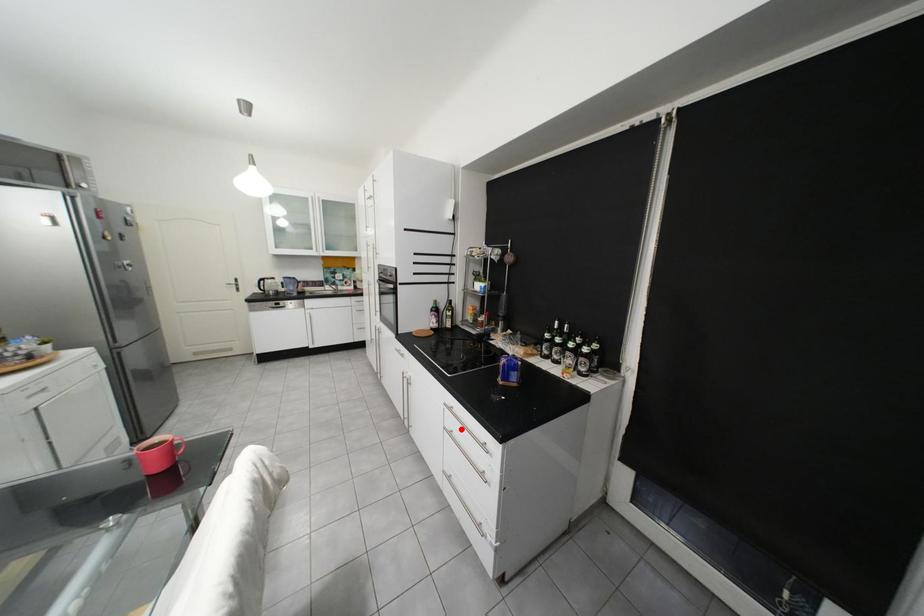
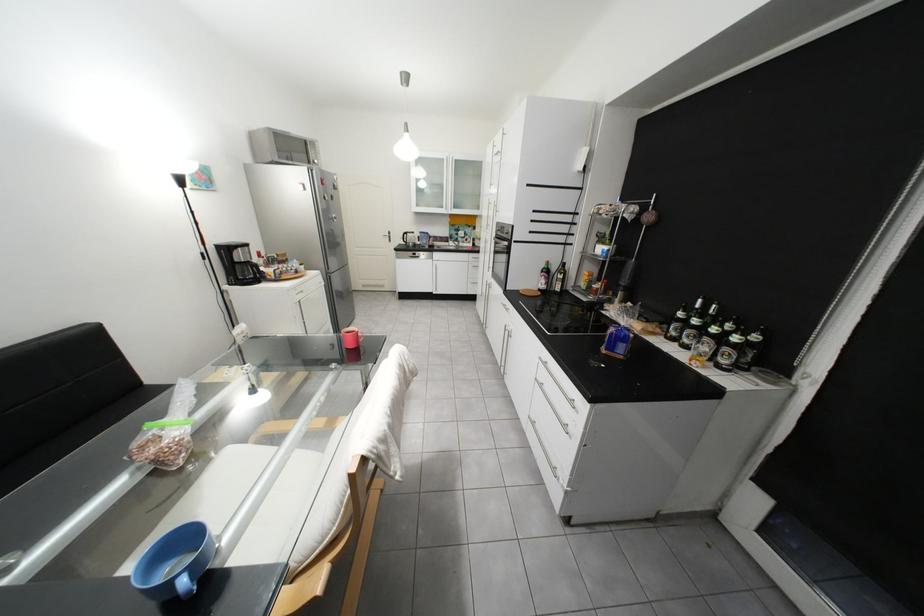
Where in the second image is the point corresponding to the highlighted location from the first image?

(553, 382)